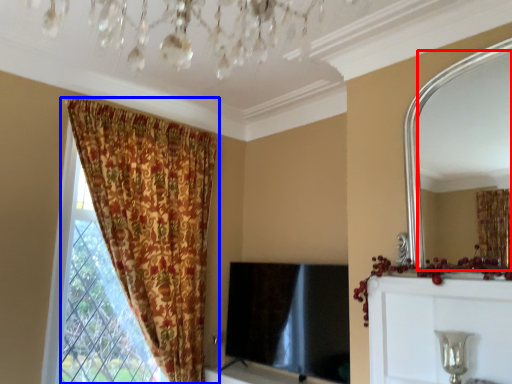
Question: Which of the following is the closest to the observer, mirror (highlighted by a red box) or curtain (highlighted by a blue box)?

Choices:
 (A) mirror
 (B) curtain

Answer: (A)